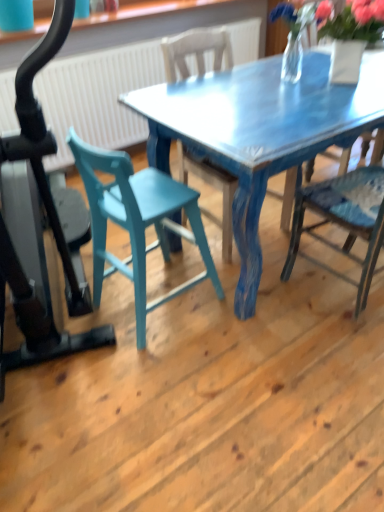
Question: Is teal wood chair at center, which appears as the first chair when viewed from the left, outside blue painted wood chair at center, the 2th chair positioned from the right?

Choices:
 (A) no
 (B) yes

Answer: (B)

Question: Is blue painted wood chair at center, which is the 2th chair in left-to-right order, at the back of teal wood chair at center, which appears as the first chair when viewed from the left?

Choices:
 (A) no
 (B) yes

Answer: (A)

Question: Is teal wood chair at center, the third chair positioned from the right, wider than blue painted wood chair at center, which is the 2th chair in left-to-right order?

Choices:
 (A) yes
 (B) no

Answer: (B)

Question: Is teal wood chair at center, the third chair positioned from the right, oriented towards blue painted wood chair at center, which is the 2th chair in left-to-right order?

Choices:
 (A) no
 (B) yes

Answer: (B)

Question: Does teal wood chair at center, the third chair positioned from the right, have a lesser width compared to blue painted wood chair at center, which is the 2th chair in left-to-right order?

Choices:
 (A) yes
 (B) no

Answer: (A)

Question: From a real-world perspective, relative to blue painted wood chair at right, which is the first chair from right to left, is teal wood chair at center, the third chair positioned from the right, vertically above or below?

Choices:
 (A) below
 (B) above

Answer: (A)

Question: Considering the positions of teal wood chair at center, which appears as the first chair when viewed from the left, and blue painted wood chair at right, the third chair positioned from the left, in the image, is teal wood chair at center, which appears as the first chair when viewed from the left, bigger or smaller than blue painted wood chair at right, the third chair positioned from the left,?

Choices:
 (A) small
 (B) big

Answer: (A)

Question: Considering the positions of teal wood chair at center, the third chair positioned from the right, and blue painted wood chair at right, the third chair positioned from the left, in the image, is teal wood chair at center, the third chair positioned from the right, wider or thinner than blue painted wood chair at right, the third chair positioned from the left,?

Choices:
 (A) wide
 (B) thin

Answer: (B)

Question: Is teal wood chair at center, the third chair positioned from the right, in front of or behind blue painted wood chair at right, the third chair positioned from the left, in the image?

Choices:
 (A) behind
 (B) front

Answer: (A)

Question: Looking at the image, does blue painted wood chair at center, the 2th chair positioned from the right, seem bigger or smaller compared to teal wood chair at center, the third chair positioned from the right?

Choices:
 (A) small
 (B) big

Answer: (B)

Question: From a real-world perspective, is blue painted wood chair at center, which is the 2th chair in left-to-right order, above or below teal wood chair at center, the third chair positioned from the right?

Choices:
 (A) above
 (B) below

Answer: (A)

Question: Is blue painted wood chair at center, which is the 2th chair in left-to-right order, to the left or to the right of teal wood chair at center, which appears as the first chair when viewed from the left, in the image?

Choices:
 (A) right
 (B) left

Answer: (A)

Question: In the image, is blue painted wood chair at center, which is the 2th chair in left-to-right order, positioned in front of or behind teal wood chair at center, the third chair positioned from the right?

Choices:
 (A) front
 (B) behind

Answer: (B)

Question: Would you say blue painted wood chair at center, the 2th chair positioned from the right, is inside or outside blue painted wood chair at right, the third chair positioned from the left?

Choices:
 (A) outside
 (B) inside

Answer: (A)

Question: From a real-world perspective, is blue painted wood chair at center, which is the 2th chair in left-to-right order, physically located above or below blue painted wood chair at right, the third chair positioned from the left?

Choices:
 (A) above
 (B) below

Answer: (B)